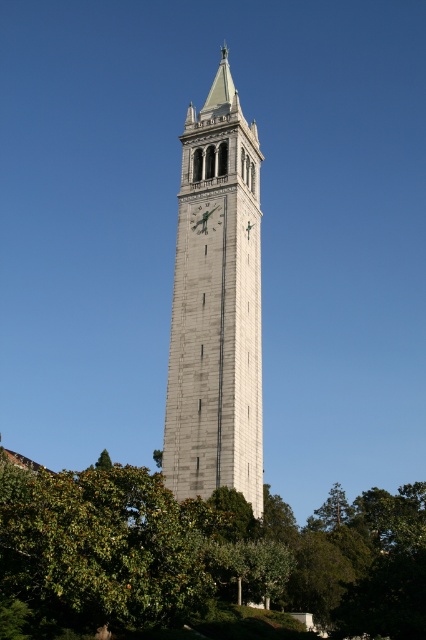
Question: Does green leafy tree at lower left appear on the left side of green metallic clock at center?

Choices:
 (A) no
 (B) yes

Answer: (A)

Question: Is white stone clock tower at center further to the viewer compared to green metallic clock at center?

Choices:
 (A) yes
 (B) no

Answer: (B)

Question: Among these points, which one is nearest to the camera?

Choices:
 (A) (206, 202)
 (B) (250, 275)
 (C) (210, 593)

Answer: (C)

Question: Which point appears closest to the camera in this image?

Choices:
 (A) (305, 532)
 (B) (204, 224)
 (C) (226, 278)

Answer: (C)

Question: Is the position of white stone clock tower at center more distant than that of green metallic clock at center?

Choices:
 (A) yes
 (B) no

Answer: (B)

Question: Which of the following is the farthest from the observer?

Choices:
 (A) green leafy tree at lower left
 (B) green metallic clock at center

Answer: (B)